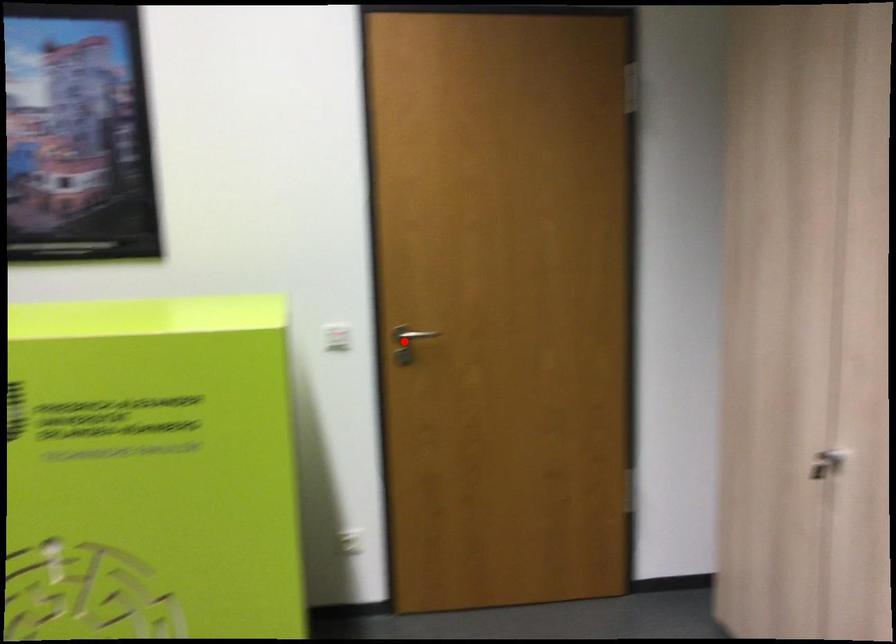
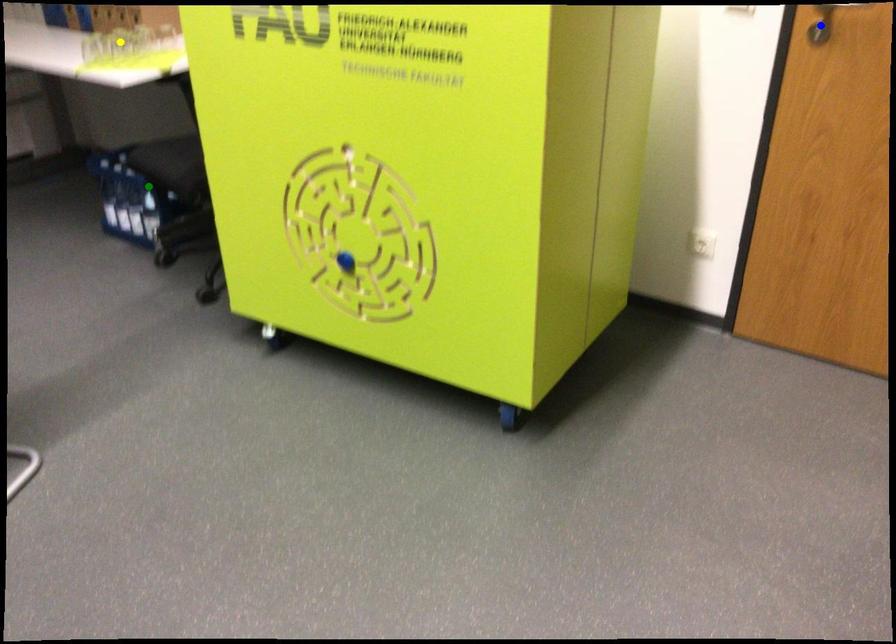
Question: I am providing you with two images of the same scene from different viewpoints. A red point is marked on the first image. You are given multiple points on the second image. In image 2, which mark is for the same physical point as the one in image 1?

Choices:
 (A) green point
 (B) blue point
 (C) yellow point

Answer: (B)